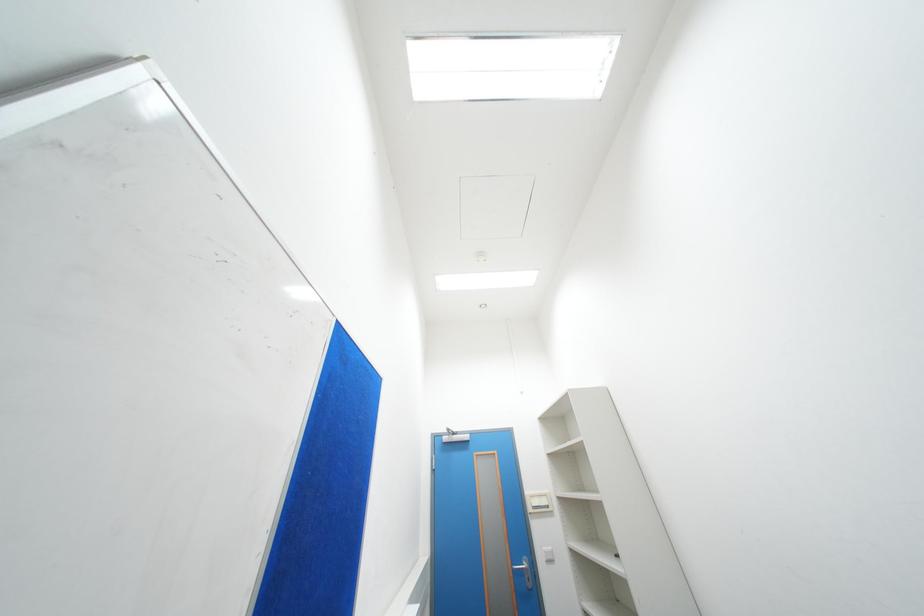
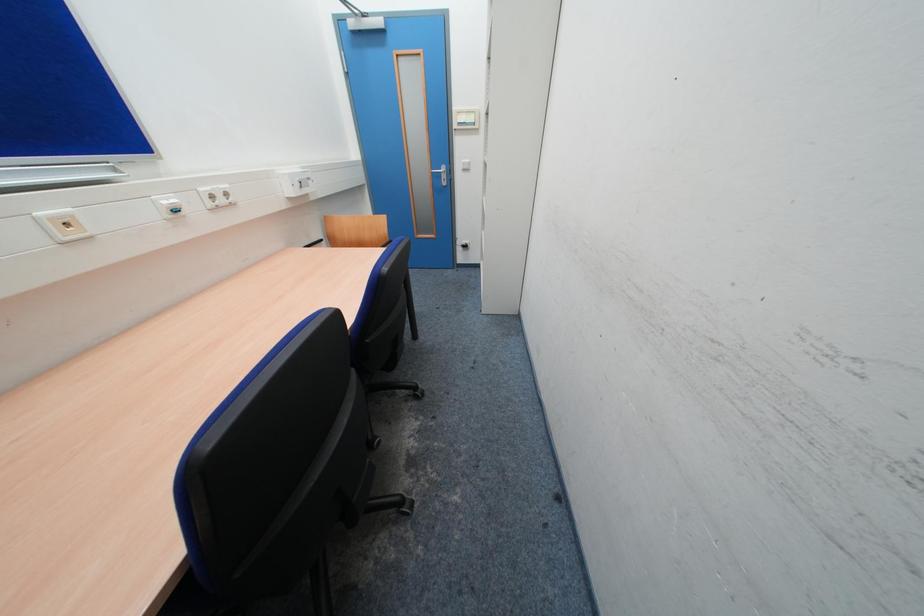
Question: The first image is from the beginning of the video and the second image is from the end. How did the camera likely rotate when shooting the video?

Choices:
 (A) Left
 (B) Right
 (C) Up
 (D) Down

Answer: (D)